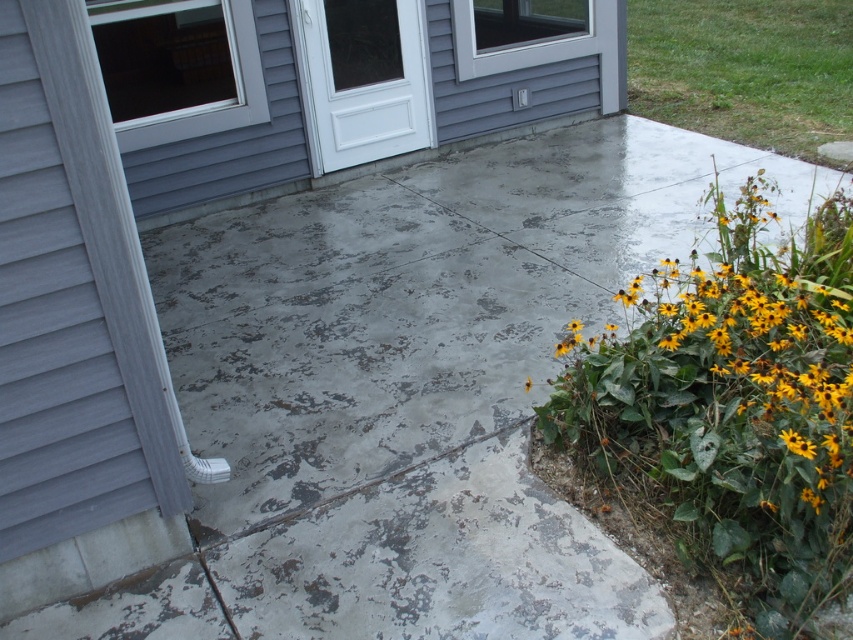
Question: Which point is farther from the camera taking this photo?

Choices:
 (A) (160, 184)
 (B) (363, 45)

Answer: (B)

Question: Does gray concrete terrace at upper center appear over white glossy door at center?

Choices:
 (A) no
 (B) yes

Answer: (B)

Question: Estimate the real-world distances between objects in this image. Which object is farther from the gray concrete terrace at upper center?

Choices:
 (A) yellow matte flower at lower right
 (B) white glossy door at center

Answer: (A)

Question: Can you confirm if gray concrete terrace at upper center is bigger than white glossy door at center?

Choices:
 (A) no
 (B) yes

Answer: (B)

Question: In this image, where is yellow matte flower at lower right located relative to gray concrete terrace at upper center?

Choices:
 (A) below
 (B) above

Answer: (A)

Question: Which point appears closest to the camera in this image?

Choices:
 (A) (334, 67)
 (B) (581, 353)
 (C) (344, 108)

Answer: (B)